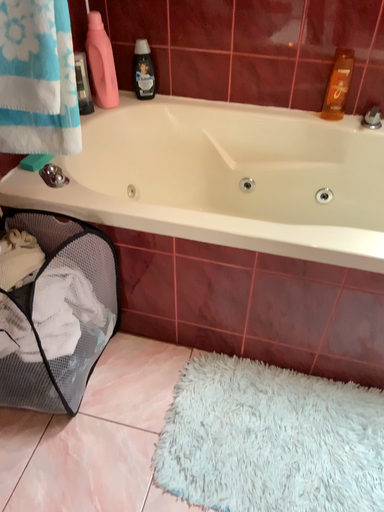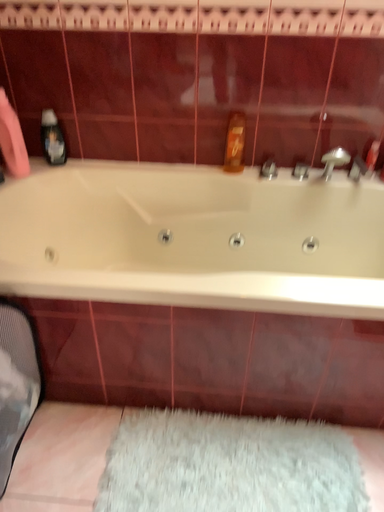
Question: Which way did the camera rotate in the video?

Choices:
 (A) rotated downward
 (B) rotated upward

Answer: (B)